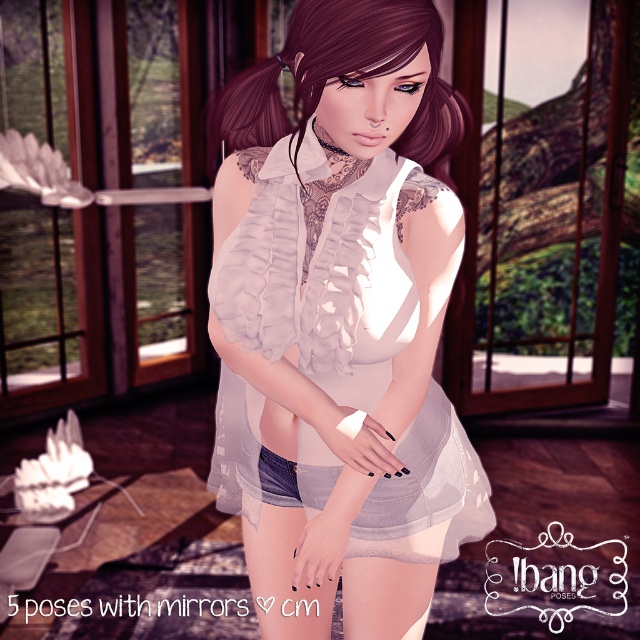
Question: Is white sheer blouse at center to the left of matte white blouse at center from the viewer's perspective?

Choices:
 (A) no
 (B) yes

Answer: (A)

Question: Is white sheer blouse at center in front of matte white blouse at center?

Choices:
 (A) yes
 (B) no

Answer: (B)

Question: Which point is farther to the camera?

Choices:
 (A) matte white blouse at center
 (B) white sheer blouse at center

Answer: (B)

Question: Which point is farther to the camera?

Choices:
 (A) white sheer blouse at center
 (B) matte white blouse at center

Answer: (A)

Question: Is white sheer blouse at center above matte white blouse at center?

Choices:
 (A) yes
 (B) no

Answer: (B)